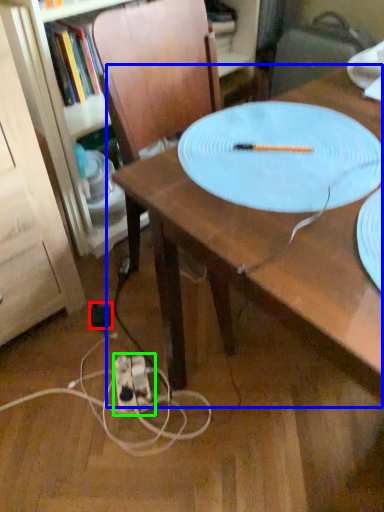
Question: Which is farther away from electric outlet (highlighted by a red box)? table (highlighted by a blue box) or extension cord (highlighted by a green box)?

Choices:
 (A) table
 (B) extension cord

Answer: (A)